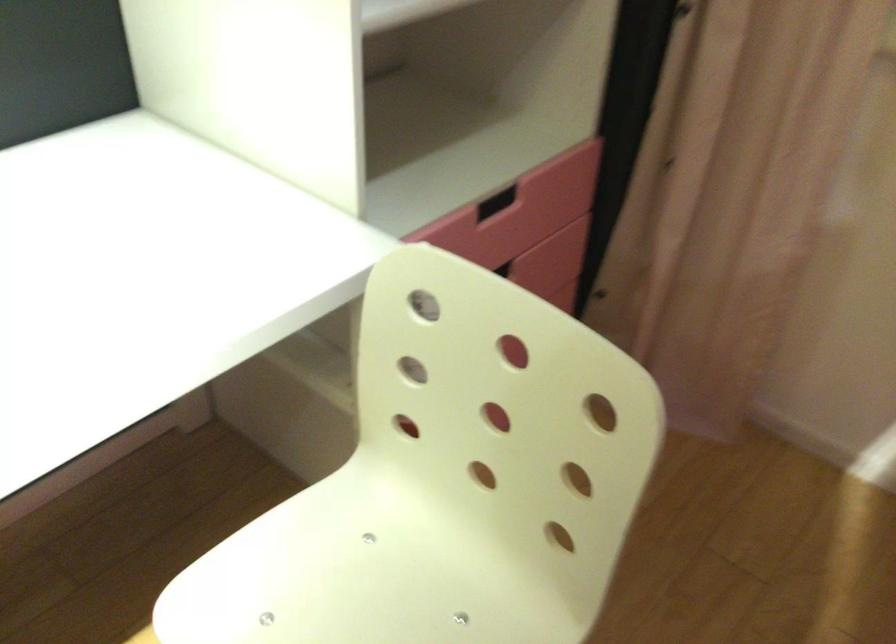
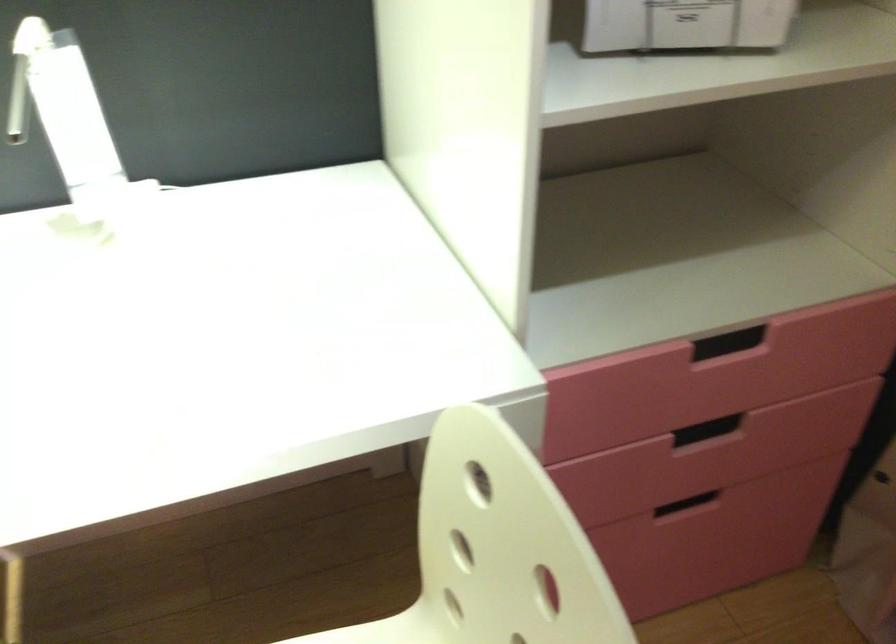
Question: The camera is either moving clockwise (left) or counter-clockwise (right) around the object. The first image is from the beginning of the video and the second image is from the end. Is the camera moving left or right when shooting the video?

Choices:
 (A) Left
 (B) Right

Answer: (B)